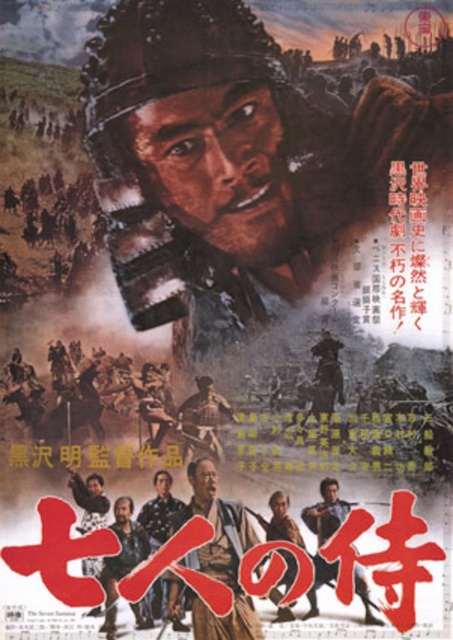
Question: Which point is closer to the camera?

Choices:
 (A) (173, 301)
 (B) (114, 582)
 (C) (168, 529)

Answer: (B)

Question: Can you confirm if matte brown uniform at center is positioned to the right of matte brown helmet at center?

Choices:
 (A) yes
 (B) no

Answer: (B)

Question: From the image, what is the correct spatial relationship of matte black samurai armor at center in relation to matte brown samurai armor at center?

Choices:
 (A) below
 (B) above

Answer: (A)

Question: Is matte black samurai armor at center closer to camera compared to matte brown samurai armor at center?

Choices:
 (A) yes
 (B) no

Answer: (B)

Question: Which object is closer to the camera taking this photo?

Choices:
 (A) matte brown samurai armor at center
 (B) dark brown leather jacket at center
 (C) matte armor at center
 (D) matte brown helmet at center

Answer: (C)

Question: Which object is positioned closest to the matte brown samurai armor at center?

Choices:
 (A) dark brown leather jacket at center
 (B) matte armor at center
 (C) matte black samurai armor at center

Answer: (A)